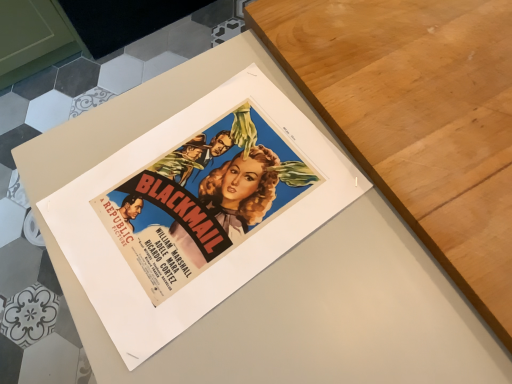
Question: Is wooden table at upper right in front of or behind matte paper poster at center in the image?

Choices:
 (A) behind
 (B) front

Answer: (A)

Question: Would you say wooden table at upper right is to the left or to the right of matte paper poster at center in the picture?

Choices:
 (A) left
 (B) right

Answer: (A)

Question: Would you say wooden table at upper right is inside or outside matte paper poster at center?

Choices:
 (A) inside
 (B) outside

Answer: (A)

Question: Is point (298, 188) closer or farther from the camera than point (396, 89)?

Choices:
 (A) closer
 (B) farther

Answer: (A)

Question: From a real-world perspective, is matte paper poster at center above or below wooden table at upper right?

Choices:
 (A) above
 (B) below

Answer: (B)

Question: In the image, is matte paper poster at center positioned in front of or behind wooden table at upper right?

Choices:
 (A) behind
 (B) front

Answer: (B)

Question: Based on their positions, is matte paper poster at center located to the left or right of wooden table at upper right?

Choices:
 (A) left
 (B) right

Answer: (B)